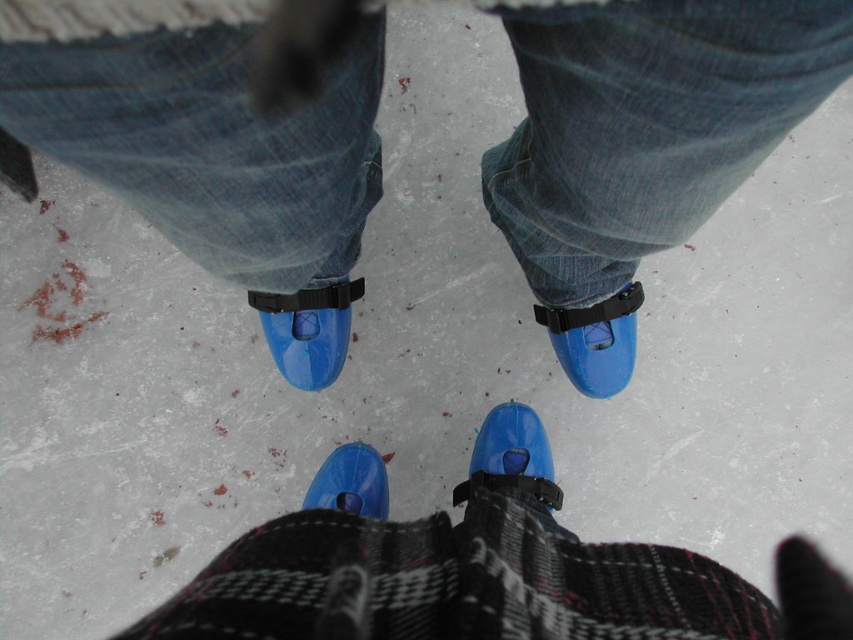
Question: Among these points, which one is nearest to the camera?

Choices:
 (A) (613, 109)
 (B) (560, 328)
 (C) (523, 428)
 (D) (791, 566)

Answer: (A)

Question: Among these objects, which one is nearest to the camera?

Choices:
 (A) blue matte ice skate at center
 (B) glossy plastic ice skates at center
 (C) blue plastic ice skate at center
 (D) translucent blue ice skate at center

Answer: (B)

Question: Does blue matte ice skate at center have a lesser width compared to translucent blue ice skate at center?

Choices:
 (A) no
 (B) yes

Answer: (B)

Question: In this image, where is blue plastic ice skate at center located relative to blue rubber ice skate at center?

Choices:
 (A) right
 (B) left

Answer: (A)

Question: Which object is the farthest from the blue rubber ice skates at center?

Choices:
 (A) blue rubber ice skate at center
 (B) translucent blue ice skate at center
 (C) glossy plastic ice skates at center
 (D) blue plastic ice skate at center

Answer: (D)

Question: Does blue rubber ice skates at center lie in front of blue matte ice skate at center?

Choices:
 (A) no
 (B) yes

Answer: (B)